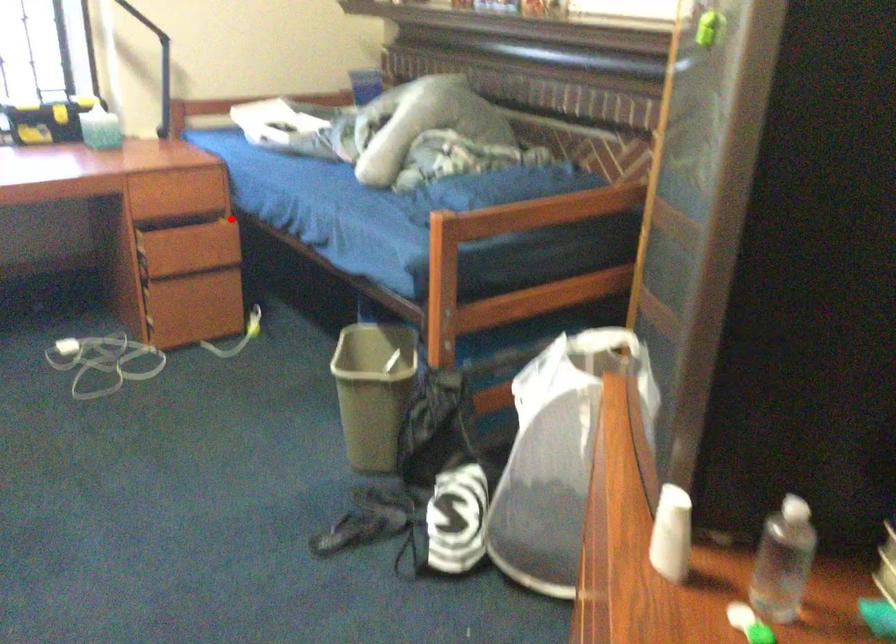
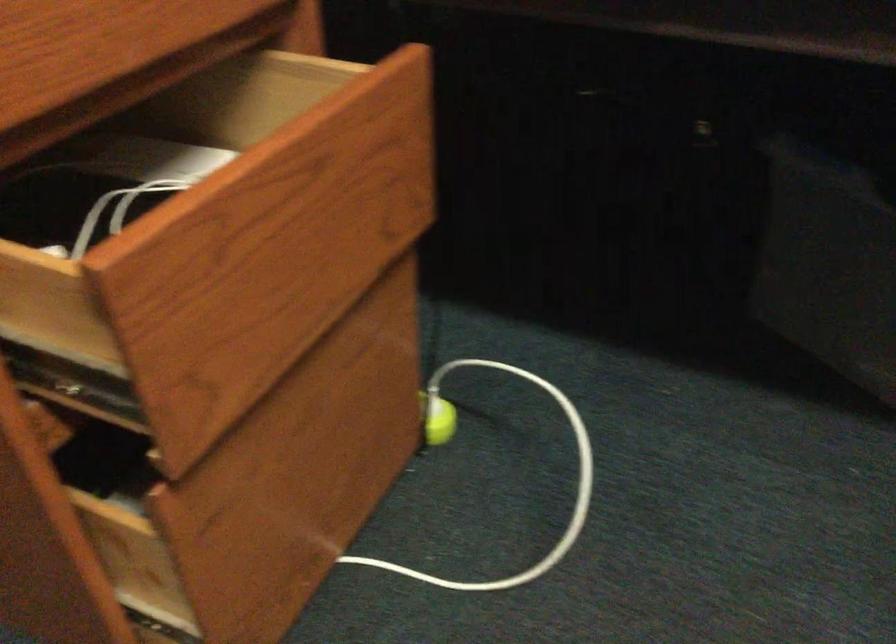
Question: I am providing you with two images of the same scene from different viewpoints. Image1 has a red point marked. In image2, the corresponding 3D location appears at what relative position? Reply with the corresponding letter.

Choices:
 (A) Closer
 (B) Farther

Answer: (A)